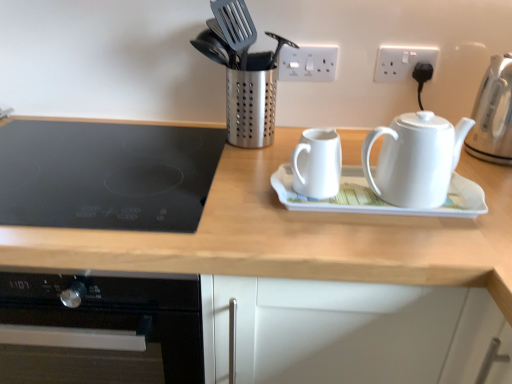
Question: Could you tell me if white plastic socket at upper center, the first electric outlet in the left-to-right sequence, is turned towards white ceramic saucer at center?

Choices:
 (A) yes
 (B) no

Answer: (A)

Question: Does white plastic socket at upper center, which appears as the second electric outlet when viewed from the right, have a larger size compared to white ceramic saucer at center?

Choices:
 (A) yes
 (B) no

Answer: (B)

Question: From the image's perspective, does white plastic socket at upper center, the first electric outlet in the left-to-right sequence, appear lower than white ceramic saucer at center?

Choices:
 (A) no
 (B) yes

Answer: (A)

Question: Does white plastic socket at upper center, the first electric outlet in the left-to-right sequence, contain white ceramic saucer at center?

Choices:
 (A) yes
 (B) no

Answer: (B)

Question: Is white plastic socket at upper center, the first electric outlet in the left-to-right sequence, at the right side of white ceramic saucer at center?

Choices:
 (A) yes
 (B) no

Answer: (B)

Question: From a real-world perspective, is white plastic electric outlet at upper right, which is counted as the first electric outlet, starting from the right, above or below white ceramic saucer at center?

Choices:
 (A) above
 (B) below

Answer: (A)

Question: From the image's perspective, relative to white ceramic saucer at center, is white plastic electric outlet at upper right, which is counted as the first electric outlet, starting from the right, above or below?

Choices:
 (A) below
 (B) above

Answer: (B)

Question: Which is correct: white plastic electric outlet at upper right, the 2th electric outlet when ordered from left to right, is inside white ceramic saucer at center, or outside of it?

Choices:
 (A) inside
 (B) outside

Answer: (B)

Question: Considering the positions of white plastic electric outlet at upper right, the 2th electric outlet when ordered from left to right, and white ceramic saucer at center in the image, is white plastic electric outlet at upper right, the 2th electric outlet when ordered from left to right, taller or shorter than white ceramic saucer at center?

Choices:
 (A) tall
 (B) short

Answer: (A)

Question: Visually, is white glossy teapot at right, which appears as the second kettle when viewed from the right, positioned to the left or to the right of white ceramic saucer at center?

Choices:
 (A) right
 (B) left

Answer: (A)

Question: Is white glossy teapot at right, the 2th kettle positioned from the left, taller or shorter than white ceramic saucer at center?

Choices:
 (A) tall
 (B) short

Answer: (A)

Question: From a real-world perspective, relative to white ceramic saucer at center, is white glossy teapot at right, the 2th kettle positioned from the left, vertically above or below?

Choices:
 (A) below
 (B) above

Answer: (B)

Question: Is white glossy teapot at right, the 2th kettle positioned from the left, inside or outside of white ceramic saucer at center?

Choices:
 (A) outside
 (B) inside

Answer: (A)

Question: From the image's perspective, is white plastic socket at upper center, which appears as the second electric outlet when viewed from the right, above or below wooden at upper center?

Choices:
 (A) above
 (B) below

Answer: (A)

Question: Based on their sizes in the image, would you say white plastic socket at upper center, the first electric outlet in the left-to-right sequence, is bigger or smaller than wooden at upper center?

Choices:
 (A) big
 (B) small

Answer: (B)